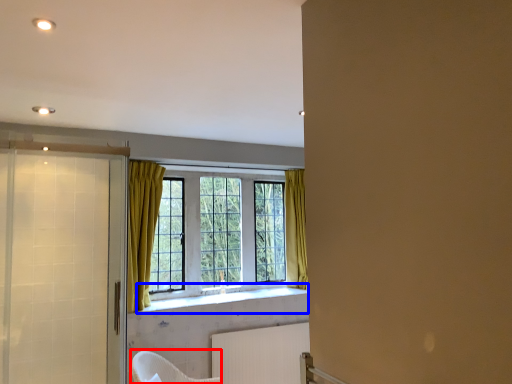
Question: Which of the following is the closest to the observer, armchair (highlighted by a red box) or window sill (highlighted by a blue box)?

Choices:
 (A) armchair
 (B) window sill

Answer: (A)